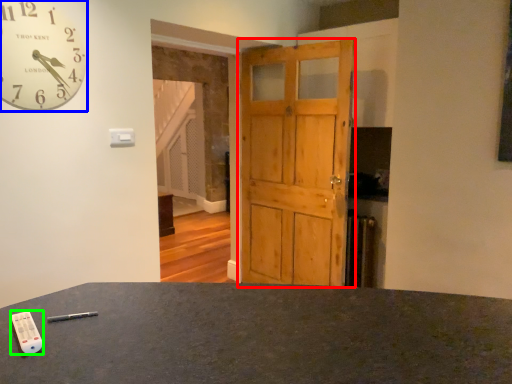
Question: Which is farther away from barn door (highlighted by a red box)? wall clock (highlighted by a blue box) or control (highlighted by a green box)?

Choices:
 (A) wall clock
 (B) control

Answer: (B)